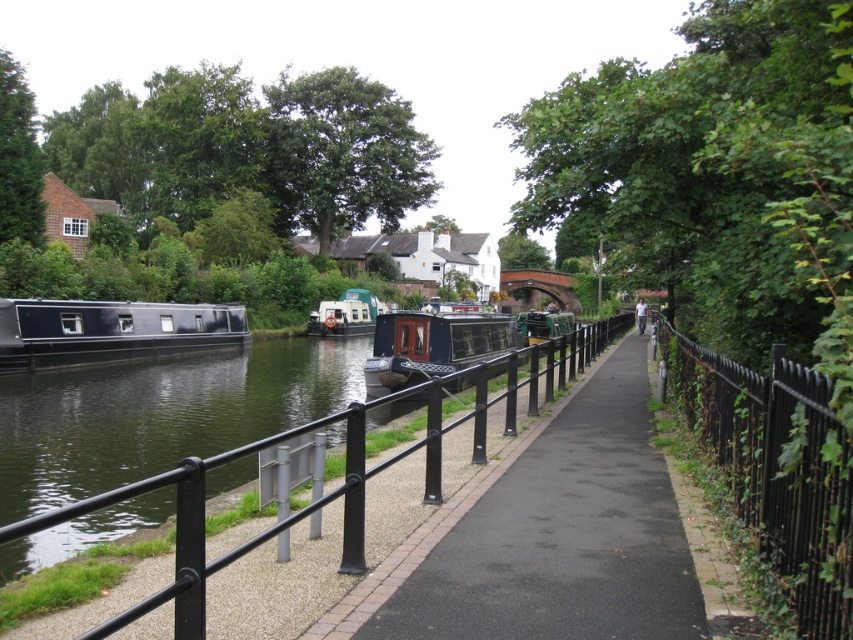
Consider the image. Which is more to the right, matte black barge at left or white plastic boat at center?

white plastic boat at center is more to the right.

Is point (68, 353) positioned before point (363, 317)?

That is True.

What are the coordinates of `matte black barge at left` in the screenshot? It's located at (109, 330).

Is black asphalt pavement at center taller than matte black barge at left?

Incorrect, black asphalt pavement at center's height is not larger of matte black barge at left's.

Which is below, black asphalt pavement at center or matte black barge at left?

Positioned lower is black asphalt pavement at center.

Who is more distant from viewer, (572,604) or (149,332)?

Positioned behind is point (149,332).

At what (x,y) coordinates should I click in order to perform the action: click on black asphalt pavement at center. Please return your answer as a coordinate pair (x, y). This screenshot has width=853, height=640. Looking at the image, I should click on (561, 536).

Does black metal/rail at center have a greater height compared to matte black barge at center?

In fact, black metal/rail at center may be shorter than matte black barge at center.

Is point (428, 385) farther from camera compared to point (451, 353)?

That is False.

Where is `black metal/rail at center`? This screenshot has height=640, width=853. black metal/rail at center is located at coordinates coord(344,474).